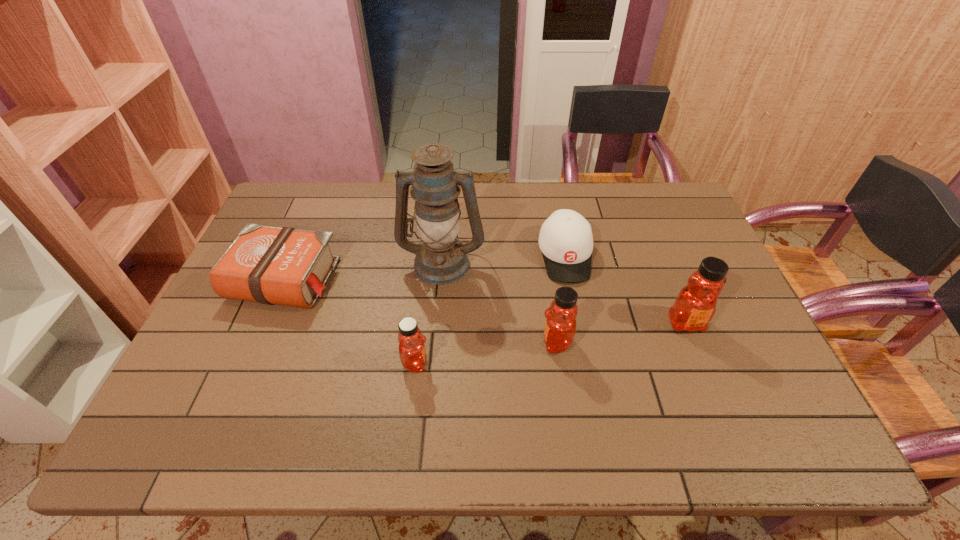
You are a GUI agent. You are given a task and a screenshot of the screen. Output one action in this format:
    pyautogui.click(x=<x>, y=<y>)
    Task: Click on the leftmost honey
    The image size is (960, 540).
    Given the screenshot: What is the action you would take?
    pyautogui.click(x=412, y=351)

The height and width of the screenshot is (540, 960). Identify the location of the shortest honey. (412, 351).

I want to click on the second tallest honey, so click(x=560, y=326).

In order to click on the third tallest object in this screenshot , I will do [560, 326].

The height and width of the screenshot is (540, 960). In order to click on the rightmost object in this screenshot , I will do `click(695, 305)`.

Where is `the leftmost object`? The height and width of the screenshot is (540, 960). the leftmost object is located at coordinates (286, 266).

What are the coordinates of `baseball cap` in the screenshot? It's located at (566, 241).

You are a GUI agent. You are given a task and a screenshot of the screen. Output one action in this format:
    pyautogui.click(x=<x>, y=<y>)
    Task: Click on the tallest object
    The image size is (960, 540).
    Given the screenshot: What is the action you would take?
    pyautogui.click(x=441, y=258)

Identify the location of free location located 0.290m on the front label of the leftmost honey. (549, 363).

This screenshot has height=540, width=960. What are the coordinates of `vacant space located on the front label of the fourth shortest object` in the screenshot? It's located at (384, 342).